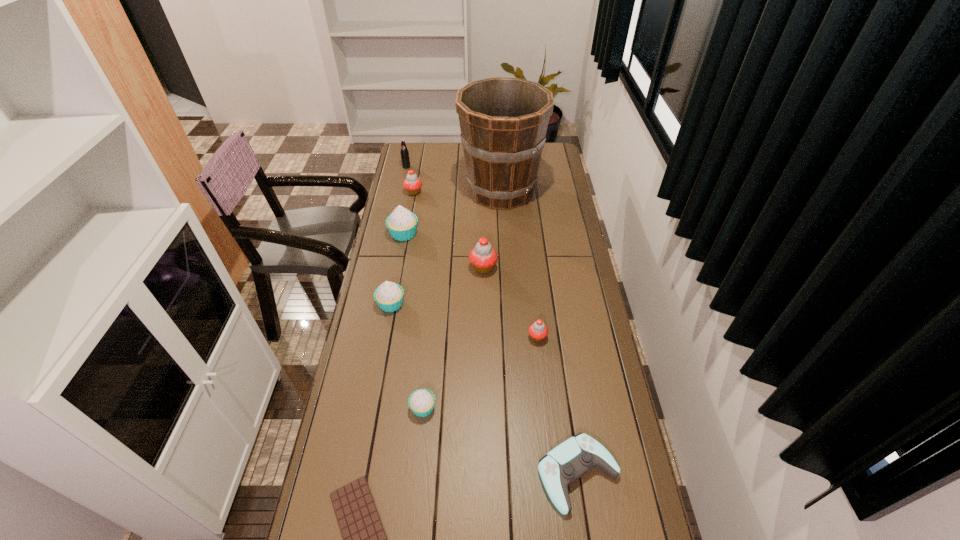
Where is `vacant space situated on the front of the farthest red cupcake`? This screenshot has height=540, width=960. vacant space situated on the front of the farthest red cupcake is located at coordinates (405, 242).

Where is `free space located on the front of the nearest cupcake`? Image resolution: width=960 pixels, height=540 pixels. free space located on the front of the nearest cupcake is located at coordinates (418, 467).

This screenshot has width=960, height=540. In order to click on vacant area located on the back of the second nearest cupcake in this screenshot , I will do `click(534, 303)`.

Locate an element on the screen. free location located 0.370m on the left of the ninth tallest object is located at coordinates (405, 474).

Locate an element on the screen. object that is at the far edge is located at coordinates pos(405,159).

Find the location of `pop that is positioned at the left edge`. pop that is positioned at the left edge is located at coordinates (405, 159).

Image resolution: width=960 pixels, height=540 pixels. I want to click on bucket that is at the right edge, so click(503, 121).

Where is `control that is at the right edge`? This screenshot has width=960, height=540. control that is at the right edge is located at coordinates (573, 458).

The width and height of the screenshot is (960, 540). Find the location of `object that is at the far left corner`. object that is at the far left corner is located at coordinates (405, 159).

Identify the location of blank area at the far edge. Image resolution: width=960 pixels, height=540 pixels. (456, 153).